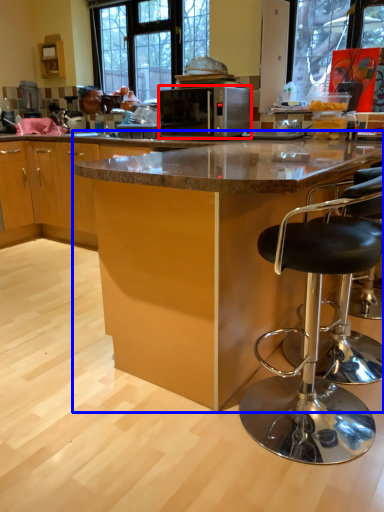
Question: Which object appears closest to the camera in this image, microwave oven (highlighted by a red box) or table (highlighted by a blue box)?

Choices:
 (A) microwave oven
 (B) table

Answer: (B)